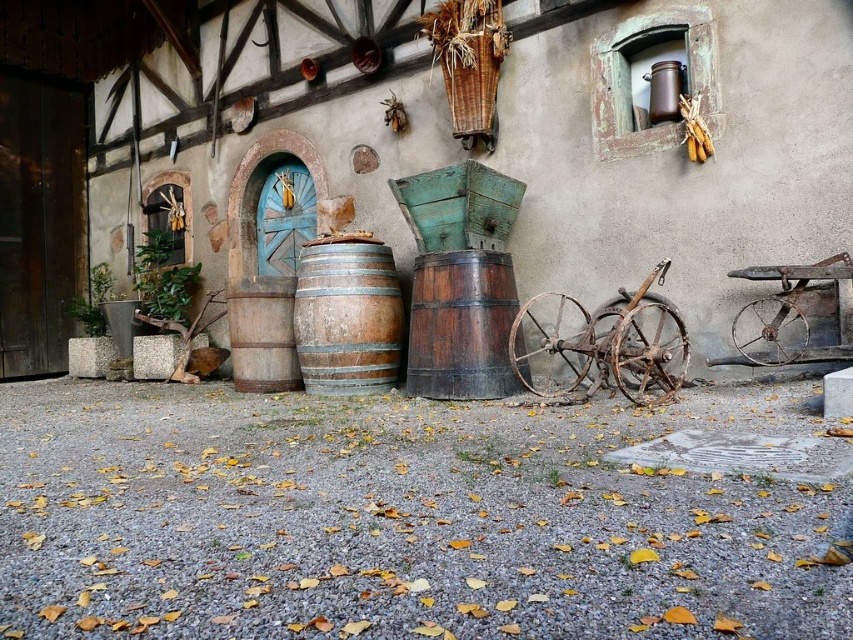
You are standing in front of the traditional building and want to move the rusty metal wagon at center to the left side of the rustic wooden barrel at center. Is this possible based on their current positions?

The rusty metal wagon at center is currently to the right of the rustic wooden barrel at center, so moving it to the left side of the rustic wooden barrel at center would require shifting its position to the left, which is possible as there is no mentioned obstruction in the scene description.